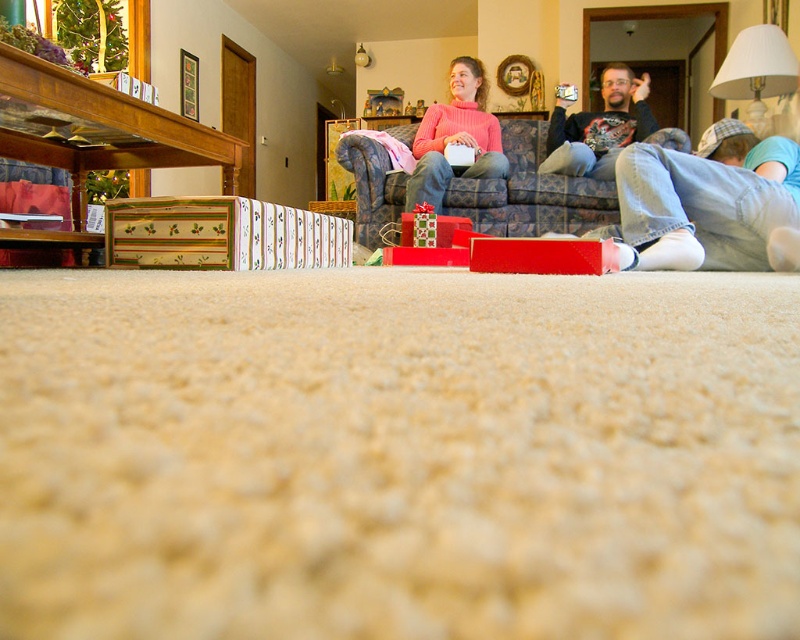
You are standing 4 meters away from the patterned fabric couch at center. Can you comfortably reach the couch to pick up a gift from it?

The distance between you and the patterned fabric couch at center is 4.16 meters. Since you are only 4 meters away, you are actually closer than the measured distance, so you can comfortably reach the couch to pick up a gift from it.

You are a guest at a holiday gathering and see the patterned fabric couch at center and the matte black shirt at center. Which object is taller?

The matte black shirt at center is taller than the patterned fabric couch at center.